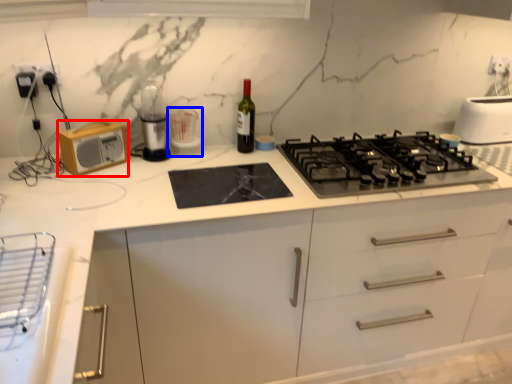
Question: Which object is further to the camera taking this photo, kitchen appliance (highlighted by a red box) or appliance (highlighted by a blue box)?

Choices:
 (A) kitchen appliance
 (B) appliance

Answer: (B)